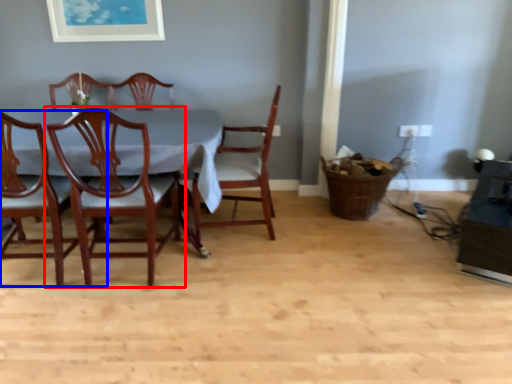
Question: Which point is closer to the camera, chair (highlighted by a red box) or chair (highlighted by a blue box)?

Choices:
 (A) chair
 (B) chair

Answer: (B)